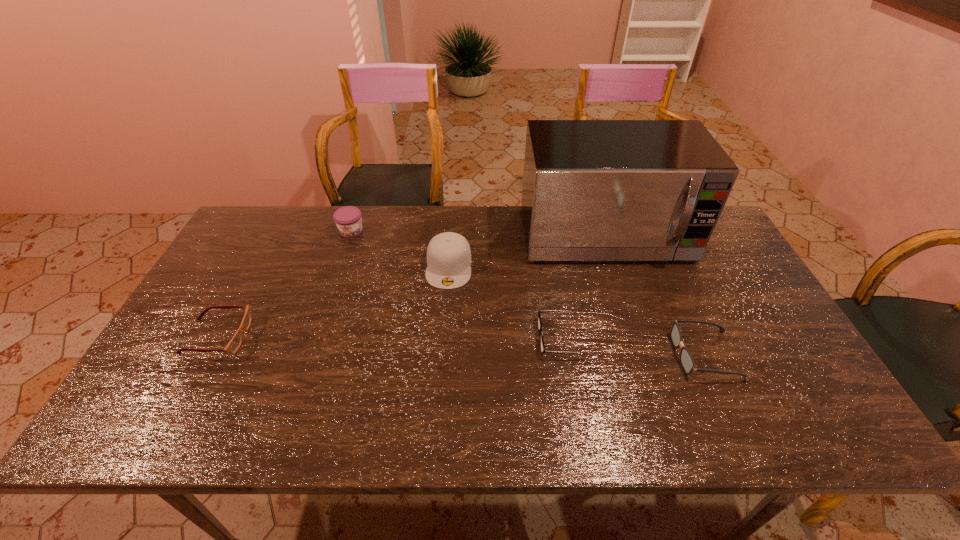
At what (x,y) coordinates should I click in order to perform the action: click on cap situated at the far edge. Please return your answer as a coordinate pair (x, y). Looking at the image, I should click on (448, 254).

Locate an element on the screen. The image size is (960, 540). jam located at the far edge is located at coordinates (348, 219).

Locate an element on the screen. object at the left edge is located at coordinates click(234, 344).

Where is `microwave oven that is at the right edge`? microwave oven that is at the right edge is located at coordinates (593, 190).

You are a GUI agent. You are given a task and a screenshot of the screen. Output one action in this format:
    pyautogui.click(x=<x>, y=<y>)
    Task: Click on the spectacles at the right edge
    This screenshot has height=540, width=960.
    Given the screenshot: What is the action you would take?
    pyautogui.click(x=686, y=359)

Identify the location of object present at the far right corner. This screenshot has height=540, width=960. (593, 190).

Locate an element on the screen. The image size is (960, 540). vacant space at the far edge of the desktop is located at coordinates (360, 238).

The width and height of the screenshot is (960, 540). Find the location of `free space at the left edge of the desktop`. free space at the left edge of the desktop is located at coordinates (208, 283).

The width and height of the screenshot is (960, 540). Find the location of `vacant region at the right edge`. vacant region at the right edge is located at coordinates (699, 267).

You are a GUI agent. You are given a task and a screenshot of the screen. Output one action in this format:
    pyautogui.click(x=<x>, y=<y>)
    Task: Click on the vacant region at the far left corner of the desktop
    
    Given the screenshot: What is the action you would take?
    pyautogui.click(x=261, y=210)